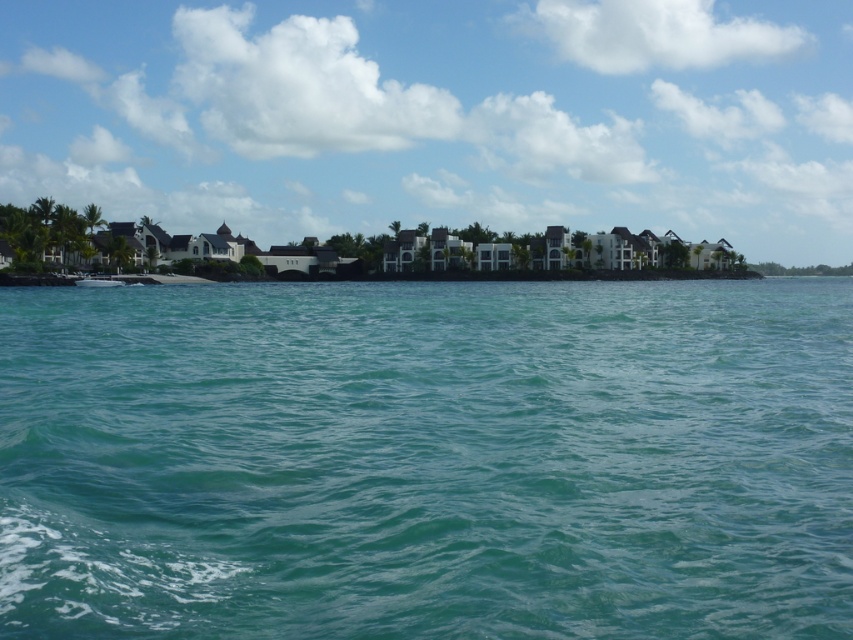
Question: In this image, where is teal water at center located relative to white glossy boat at center?

Choices:
 (A) right
 (B) left

Answer: (A)

Question: Which object appears farthest from the camera in this image?

Choices:
 (A) white glossy boat at center
 (B) teal water at center

Answer: (A)

Question: Can you confirm if teal water at center is bigger than white glossy boat at center?

Choices:
 (A) yes
 (B) no

Answer: (A)

Question: Is teal water at center positioned behind white glossy boat at center?

Choices:
 (A) yes
 (B) no

Answer: (B)